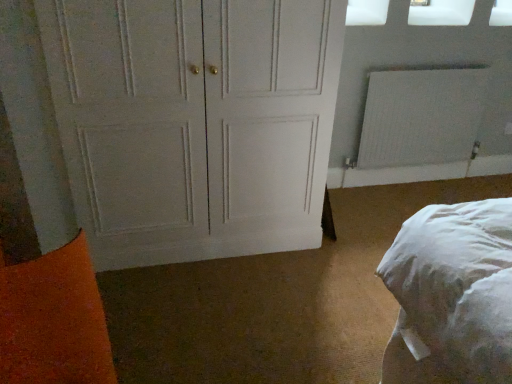
In order to click on free space above white textured radiator at upper right (from a real-world perspective) in this screenshot , I will do `click(435, 62)`.